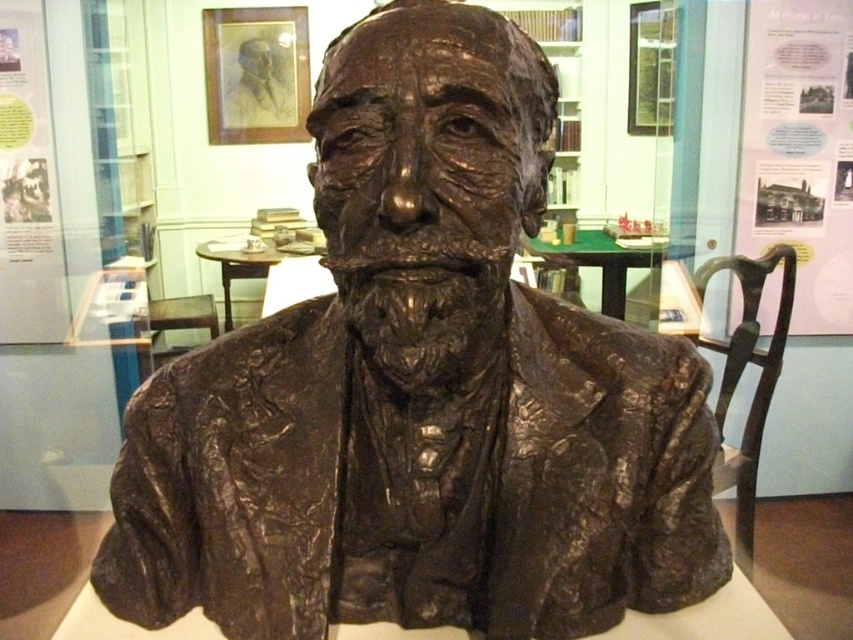
Question: Is bronze polished chair at right positioned before smooth gray pencil sketch at upper center?

Choices:
 (A) yes
 (B) no

Answer: (A)

Question: Can you confirm if bronze polished chair at right is wider than smooth gray pencil sketch at upper center?

Choices:
 (A) yes
 (B) no

Answer: (A)

Question: Is bronze polished chair at right positioned behind smooth gray pencil sketch at upper center?

Choices:
 (A) no
 (B) yes

Answer: (A)